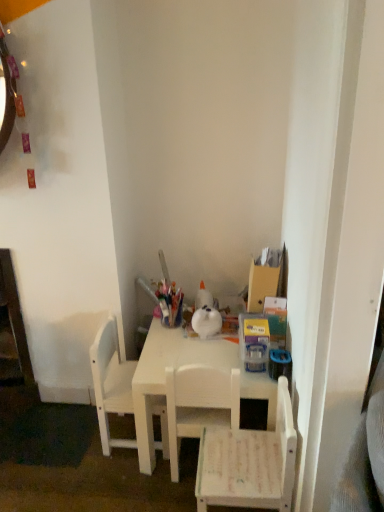
Identify the location of vacant space in front of white matte chair at left, which ranks as the 3th chair in right-to-left order. (116, 482).